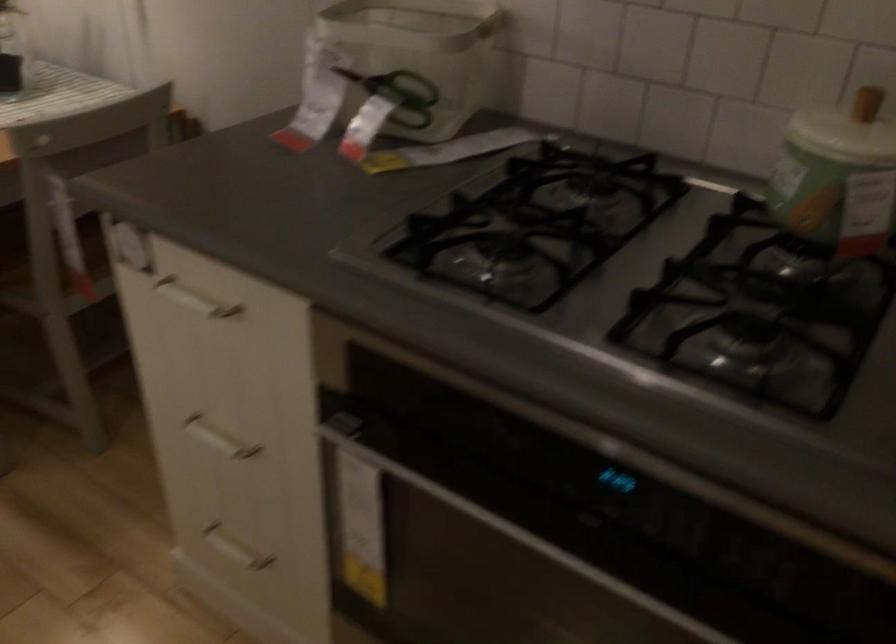
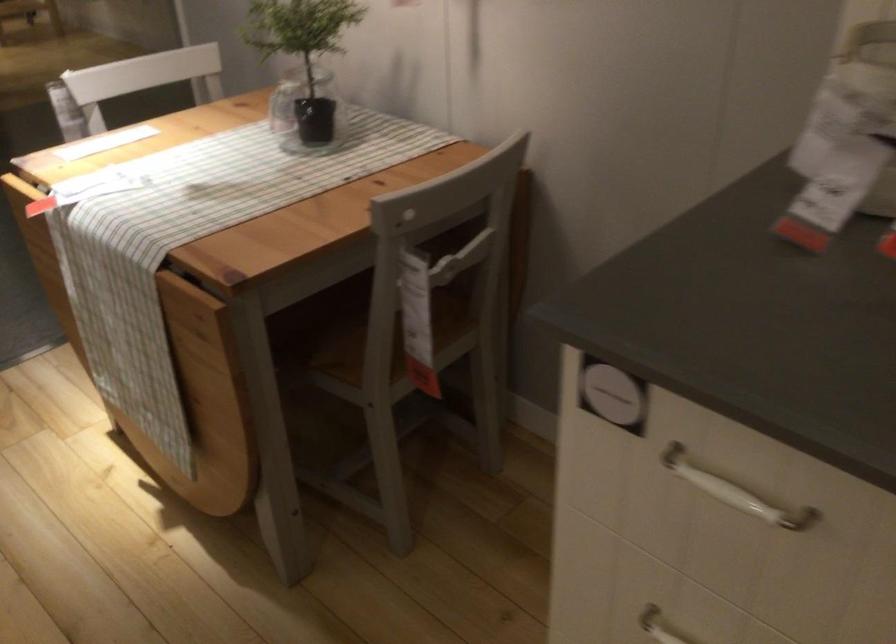
In a continuous first-person perspective shot, in which direction is the camera moving?

The cameraman moved toward left, forward.